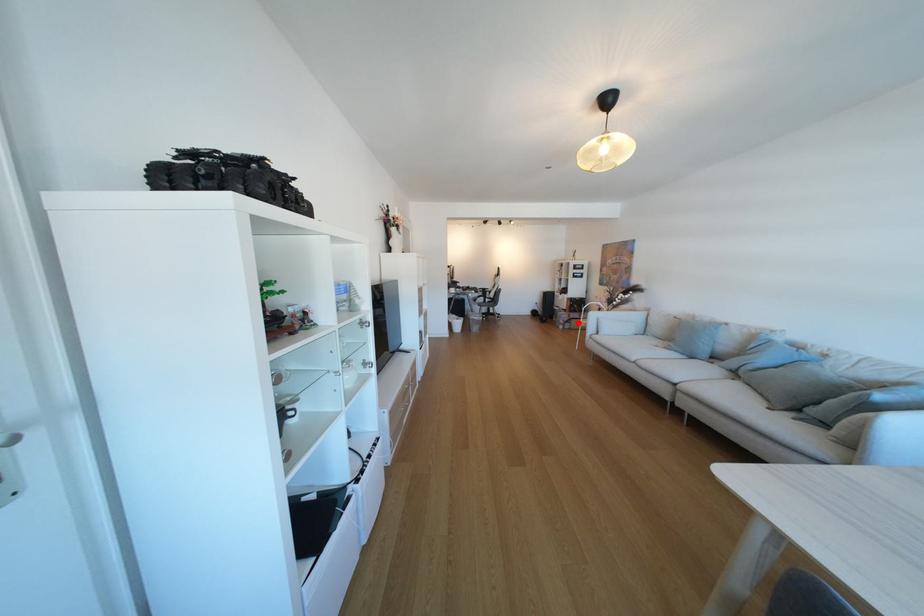
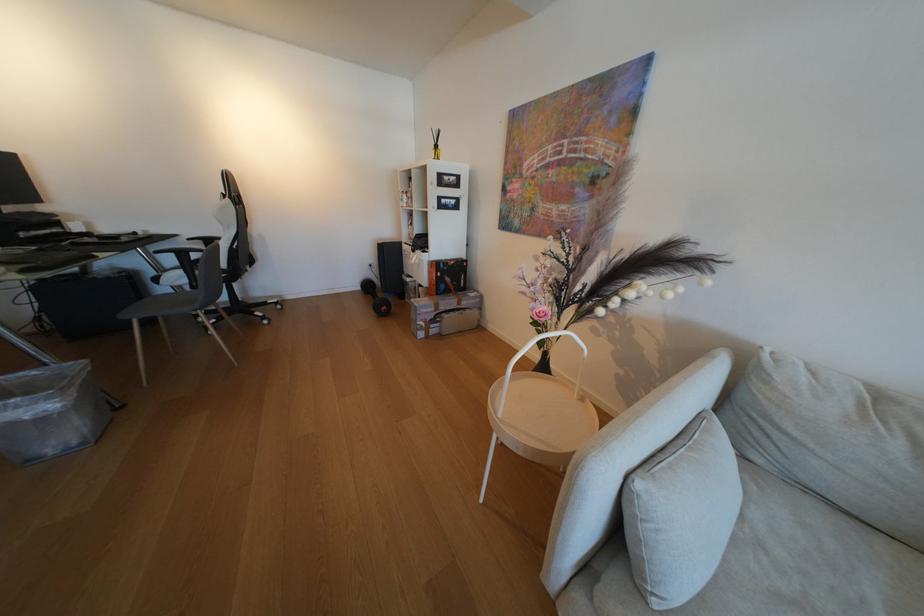
Find the pixel in the second image that matches the highlighted location in the first image.

(444, 322)